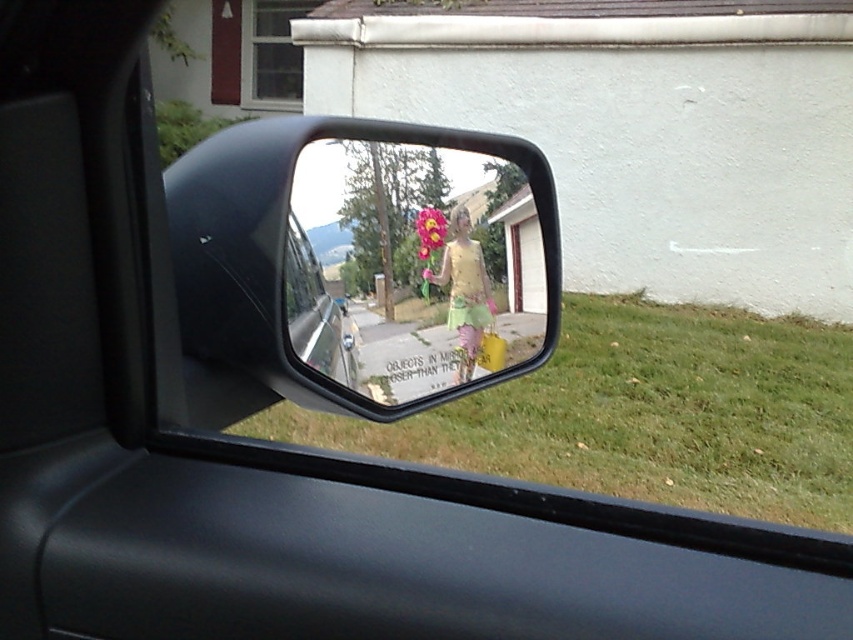
You are a florist arranging a bouquet and see the reflection in the side mirror. You notice two flowers in the bouquet, a matte yellow flower at center and a fluffy pink flower at center. Which flower has a wider spread in the reflection?

The matte yellow flower at center has a wider spread than the fluffy pink flower at center in the reflection.

You are looking at the reflection in the side mirror of a vehicle. You notice a point marked at coordinates (410,268). What object is located at this point in the mirror?

The matte yellow flower at center is located at point (410,268).

What is the exact coordinate of the matte yellow flower at center in the image?

The matte yellow flower at center is located at point (410, 268).